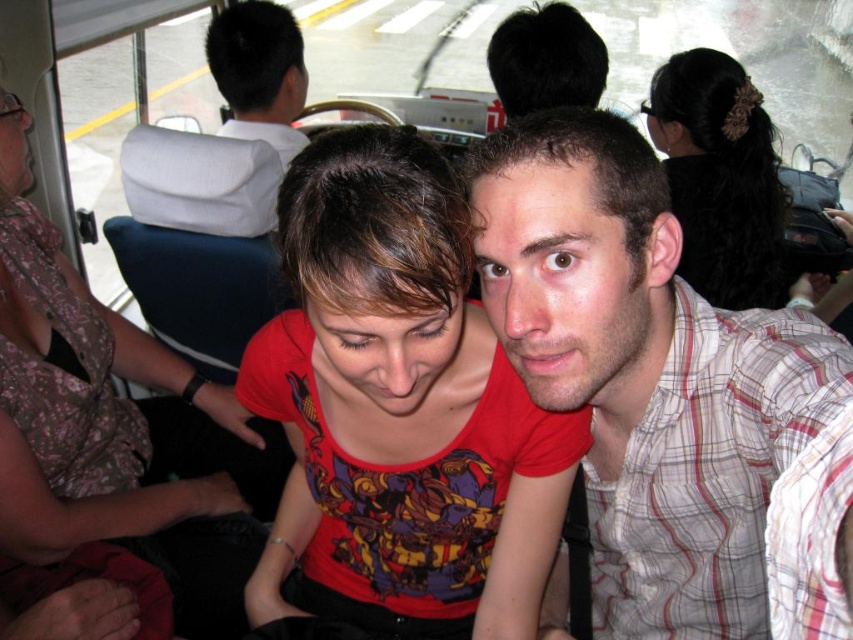
Question: Which point is farther from the camera taking this photo?

Choices:
 (A) (225, 68)
 (B) (216, 604)

Answer: (A)

Question: Among these points, which one is farthest from the camera?

Choices:
 (A) (518, 196)
 (B) (296, 29)
 (C) (56, 349)

Answer: (B)

Question: Is matte red shirt at center closer to camera compared to dark brown hair at upper right?

Choices:
 (A) yes
 (B) no

Answer: (A)

Question: Is matte red shirt at center above white shirt at upper center?

Choices:
 (A) yes
 (B) no

Answer: (B)

Question: Which object is the farthest from the dark brown hair at upper right?

Choices:
 (A) white shirt at upper center
 (B) plaid cotton shirt at center
 (C) matte red shirt at center

Answer: (C)

Question: Can you confirm if plaid cotton shirt at center is thinner than dark brown hair at upper right?

Choices:
 (A) no
 (B) yes

Answer: (B)